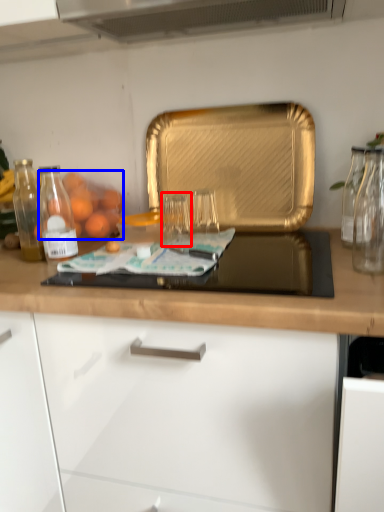
Question: Which object is further to the camera taking this photo, glass jar (highlighted by a red box) or fruit (highlighted by a blue box)?

Choices:
 (A) glass jar
 (B) fruit

Answer: (B)